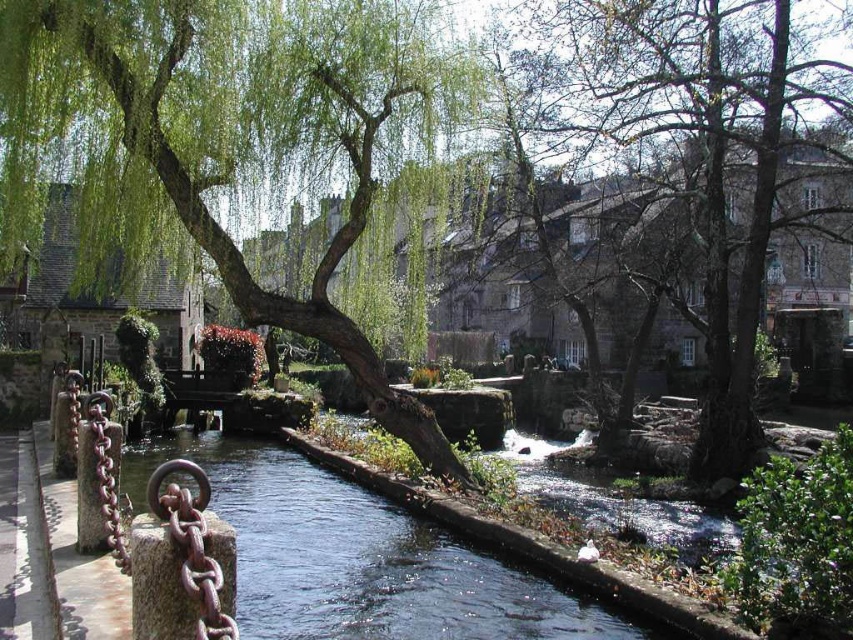
From the picture: In the village scene, you see a point marked at coordinates (229, 134). Which object from the list below is located at that point? Choose from the following options. A. Stone post with chains B. Green leafy willow at center C. Reflective stream water

The point at (229, 134) is located on the green leafy willow at center.

You are standing at the edge of the village stream and see two points marked in the scene. The first point is located at coordinates point (236, 100) and the second at point (556, 588). Which point is closer to you?

Point (236, 100) is further to the camera than point (556, 588), so the point closer to you is point (556, 588).

You are a gardener planning to plant a new tree in the village. You have two options from the image, the green leafy willow at center and the smooth bark tree at center. If you want to choose the narrower tree for a space with limited width, which one should you select?

The green leafy willow at center has a smaller width than the smooth bark tree at center, so it is the better choice for a space with limited width.